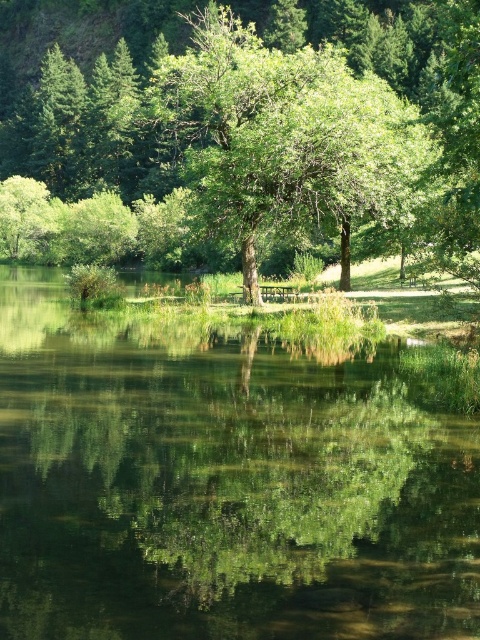
Question: Which point is closer to the camera taking this photo?

Choices:
 (A) (328, 161)
 (B) (444, 477)

Answer: (B)

Question: Does green reflective water at center appear on the left side of green leafy tree at center?

Choices:
 (A) no
 (B) yes

Answer: (A)

Question: Is green reflective water at center to the right of green leafy tree at center from the viewer's perspective?

Choices:
 (A) no
 (B) yes

Answer: (B)

Question: Which point is closer to the camera taking this photo?

Choices:
 (A) (423, 502)
 (B) (446, 227)

Answer: (A)

Question: Is green reflective water at center smaller than green leafy tree at center?

Choices:
 (A) yes
 (B) no

Answer: (A)